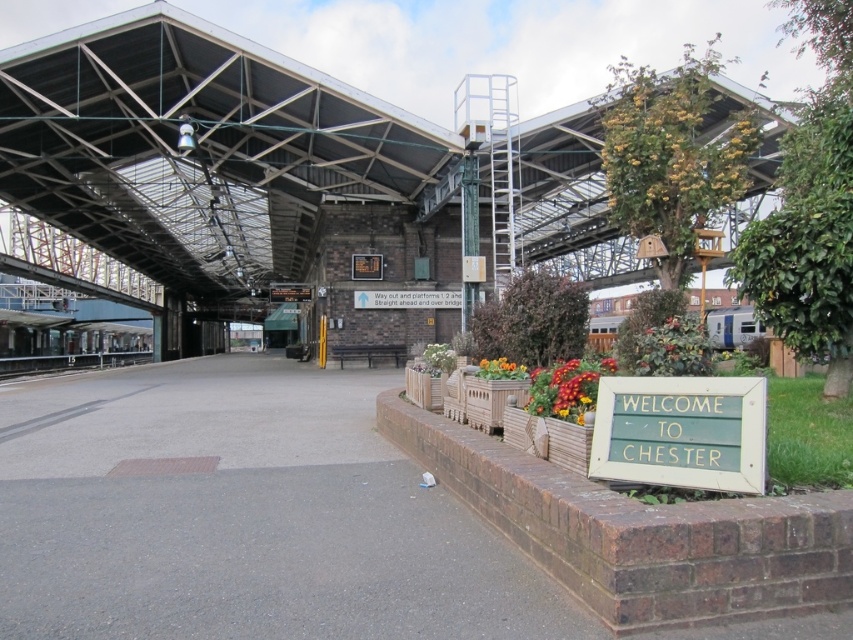
Does green wooden sign at lower right appear over black metal train track at left?

Yes.

Is point (599, 442) positioned after point (3, 371)?

No, it is not.

Where is `green wooden sign at lower right`? green wooden sign at lower right is located at coordinates (682, 432).